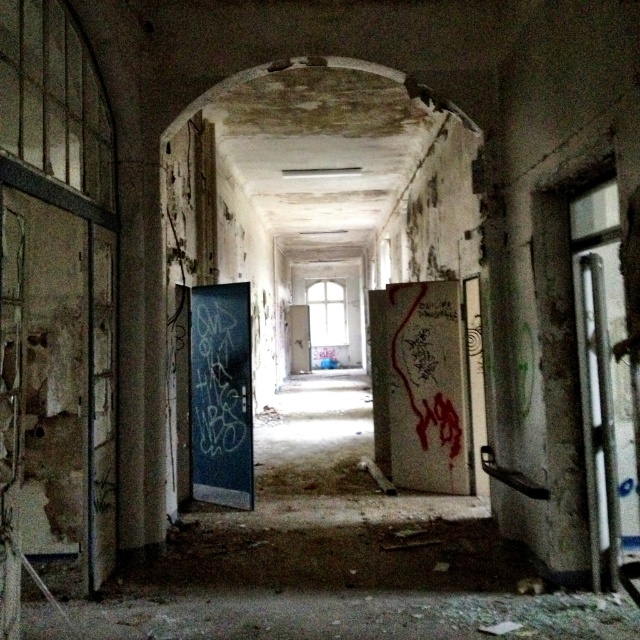
You are a maintenance worker in the building and need to enter the hallway. You see the dark blue painted door at center and the white matte door at center. Which door is taller?

The white matte door at center is taller than the dark blue painted door at center.

You are a maintenance worker who needs to inspect the dark blue painted door at center. Your tool kit is 1.5 meters long. If you are standing at the camera position, can you reach the door with your tool?

The dark blue painted door at center is 6.23 meters away from camera. Since the tool kit is only 1.5 meters long, you cannot reach the door with your tool.